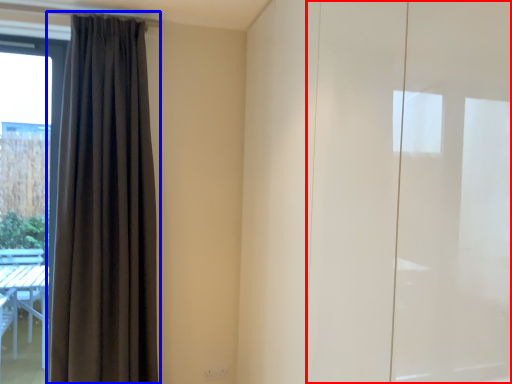
Question: Which object is closer to the camera taking this photo, screen door (highlighted by a red box) or curtain (highlighted by a blue box)?

Choices:
 (A) screen door
 (B) curtain

Answer: (A)